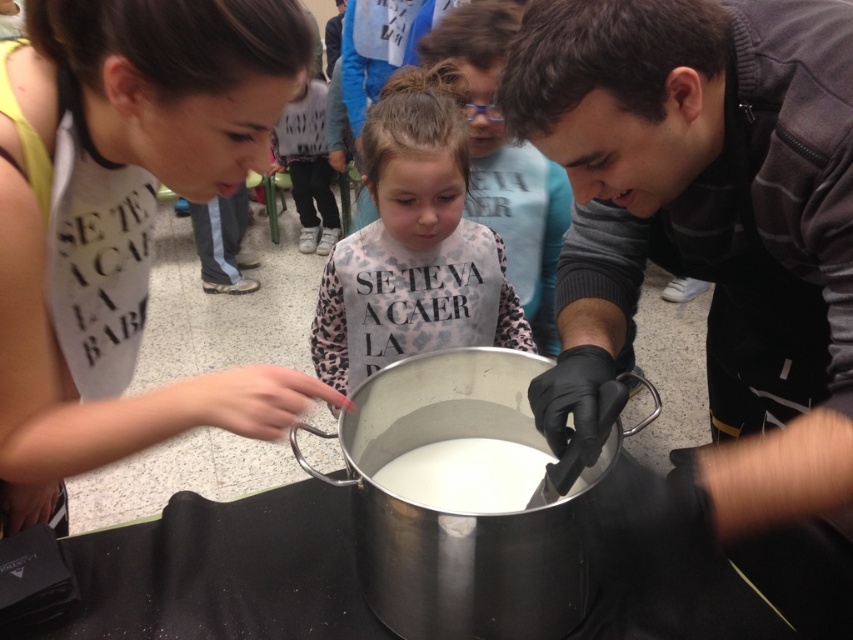
You are standing in the room and want to hand a note to the person wearing the leopard print sweater at center without disturbing the person in the matte white shirt at center. Which direction should you approach from?

You should approach from the right side of the leopard print sweater at center since the matte white shirt at center is on the left side of it, so approaching from the right would avoid disturbing the person in the matte white shirt at center.

You are a photographer standing in front of the black tablecloth with the large metallic pot. You want to take a photo that includes both the matte white shirt at center and leopard print sweater at center. Given that your camera has a 12 inch focus range, will you be able to capture both in the same frame without moving the camera?

The matte white shirt at center is 24.24 inches from the leopard print sweater at center. Since the camera has a 12 inch focus range, which is half the distance between them, you will not be able to capture both in the same frame without moving the camera.

Consider the image. What is located at the coordinates point [123,221]?

The matte white shirt at center is located at point [123,221].